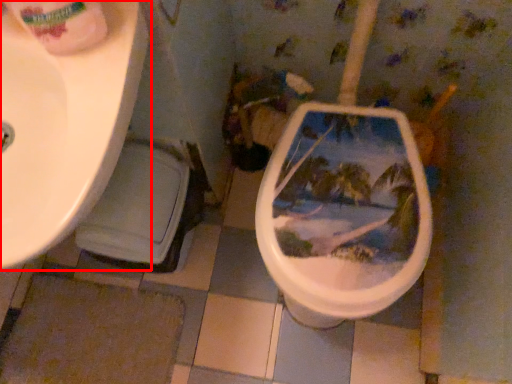
Question: From the image's perspective, where is sink (annotated by the red box) located relative to toilet paper?

Choices:
 (A) above
 (B) below

Answer: (B)